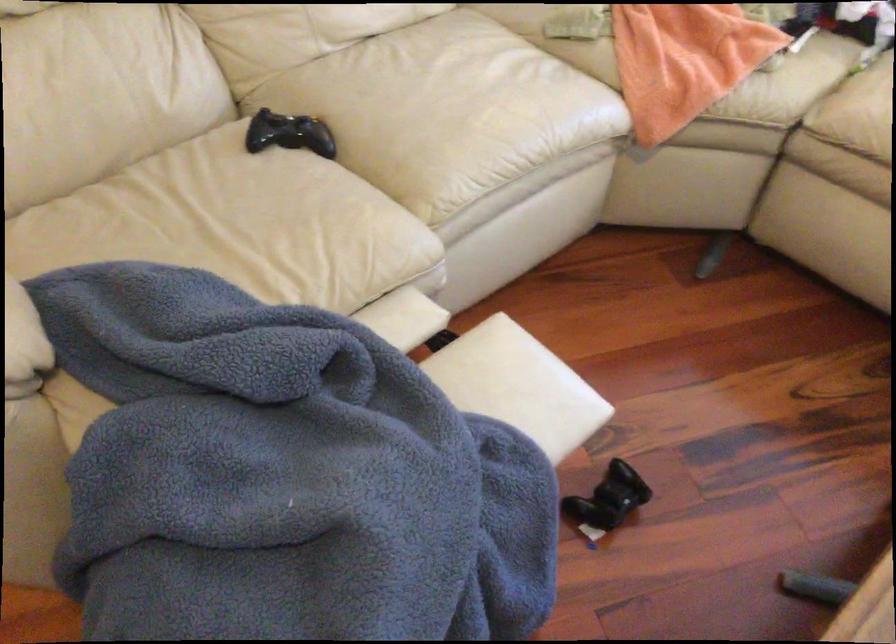
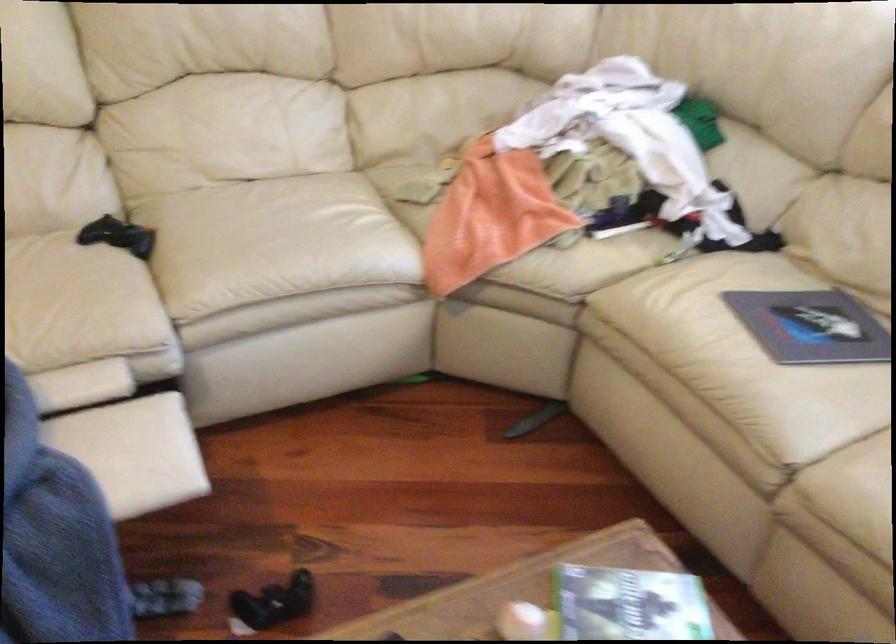
Question: The camera is either moving clockwise (left) or counter-clockwise (right) around the object. The first image is from the beginning of the video and the second image is from the end. Is the camera moving left or right when shooting the video?

Choices:
 (A) Left
 (B) Right

Answer: (B)